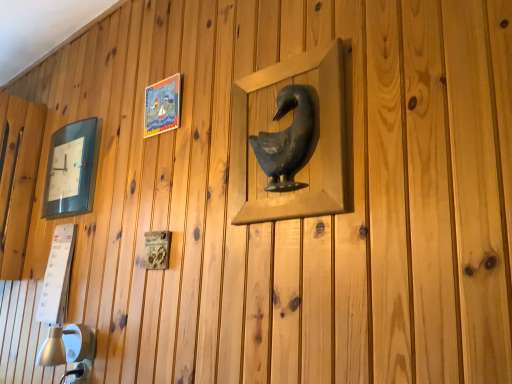
Find the location of a particular element. This screenshot has width=512, height=384. matte plastic picture frame at upper left, the 2th picture frame when ordered from back to front is located at coordinates (162, 106).

Describe the element at coordinates (286, 125) in the screenshot. This screenshot has height=384, width=512. I see `metallic gray bird at center, the first picture frame in the front-to-back sequence` at that location.

At what (x,y) coordinates should I click in order to perform the action: click on matte plastic picture frame at upper left, the second picture frame when ordered from front to back. Please return your answer as a coordinate pair (x, y). The image size is (512, 384). Looking at the image, I should click on (162, 106).

Considering the positions of points (295, 211) and (76, 165), is point (295, 211) farther from camera compared to point (76, 165)?

No, (295, 211) is in front of (76, 165).

Which object is more forward, metallic gray bird at center, the first picture frame when ordered from right to left, or matte black clock at left, the first picture frame from the back?

metallic gray bird at center, the first picture frame when ordered from right to left, is more forward.

Is metallic gray bird at center, the first picture frame when ordered from right to left, thinner than matte black clock at left, the 3th picture frame when ordered from right to left?

Indeed, metallic gray bird at center, the first picture frame when ordered from right to left, has a lesser width compared to matte black clock at left, the 3th picture frame when ordered from right to left.

Consider the image. Could you tell me if metallic gray bird at center, arranged as the 3th picture frame when viewed from the back, is facing matte black clock at left, the first picture frame from the back?

No.

Would you consider matte plastic picture frame at upper left, the second picture frame when ordered from front to back, to be distant from matte black clock at left, the 3th picture frame when ordered from right to left?

No, matte plastic picture frame at upper left, the second picture frame when ordered from front to back, is not far away from matte black clock at left, the 3th picture frame when ordered from right to left.

From the image's perspective, starting from the matte plastic picture frame at upper left, marked as the 2th picture frame in a right-to-left arrangement, which picture frame is the 2nd one below? Please provide its 2D coordinates.

[(72, 169)]

Is matte plastic picture frame at upper left, the second picture frame when ordered from front to back, located outside matte black clock at left, the 3th picture frame when ordered from right to left?

That's correct, matte plastic picture frame at upper left, the second picture frame when ordered from front to back, is outside of matte black clock at left, the 3th picture frame when ordered from right to left.

From the image's perspective, which one is positioned lower, matte plastic picture frame at upper left, the 2th picture frame when ordered from back to front, or matte black clock at left, placed as the third picture frame when sorted from front to back?

matte black clock at left, placed as the third picture frame when sorted from front to back, from the image's perspective.

Which object is further away from the camera taking this photo, matte plastic picture frame at upper left, the second picture frame when ordered from front to back, or metallic gray bird at center, arranged as the 3th picture frame when viewed from the back?

matte plastic picture frame at upper left, the second picture frame when ordered from front to back, is behind.

How far apart are matte plastic picture frame at upper left, marked as the 2th picture frame in a right-to-left arrangement, and metallic gray bird at center, the first picture frame when ordered from right to left?

matte plastic picture frame at upper left, marked as the 2th picture frame in a right-to-left arrangement, and metallic gray bird at center, the first picture frame when ordered from right to left, are 37.50 centimeters apart.

Considering the positions of points (181, 77) and (274, 216), is point (181, 77) farther from camera compared to point (274, 216)?

Yes, it is behind point (274, 216).

From a real-world perspective, which object stands above the other?

matte plastic picture frame at upper left, the 2th picture frame when ordered from left to right, from a real-world perspective.

Can you confirm if matte black clock at left, the 1th picture frame when ordered from left to right, is smaller than matte plastic picture frame at upper left, the second picture frame when ordered from front to back?

No, matte black clock at left, the 1th picture frame when ordered from left to right, is not smaller than matte plastic picture frame at upper left, the second picture frame when ordered from front to back.

Can matte plastic picture frame at upper left, marked as the 2th picture frame in a right-to-left arrangement, be found inside matte black clock at left, placed as the third picture frame when sorted from front to back?

No, matte plastic picture frame at upper left, marked as the 2th picture frame in a right-to-left arrangement, is not inside matte black clock at left, placed as the third picture frame when sorted from front to back.

Is matte black clock at left, the 3th picture frame when ordered from right to left, positioned with its back to matte plastic picture frame at upper left, marked as the 2th picture frame in a right-to-left arrangement?

No.

Identify the location of picture frame above the matte black clock at left, placed as the third picture frame when sorted from front to back (from a real-world perspective). (162, 106).

From a real-world perspective, is matte black clock at left, the first picture frame from the back, physically located above or below metallic gray bird at center, which is the third picture frame from left to right?

From a real-world perspective, matte black clock at left, the first picture frame from the back, is physically above metallic gray bird at center, which is the third picture frame from left to right.

Is metallic gray bird at center, the first picture frame in the front-to-back sequence, surrounded by matte black clock at left, placed as the third picture frame when sorted from front to back?

No, metallic gray bird at center, the first picture frame in the front-to-back sequence, is located outside of matte black clock at left, placed as the third picture frame when sorted from front to back.

Looking at their sizes, would you say matte black clock at left, the 1th picture frame when ordered from left to right, is wider or thinner than metallic gray bird at center, which is the third picture frame from left to right?

Clearly, matte black clock at left, the 1th picture frame when ordered from left to right, has more width compared to metallic gray bird at center, which is the third picture frame from left to right.

Is metallic gray bird at center, the first picture frame when ordered from right to left, at the back of matte black clock at left, the first picture frame from the back?

No, matte black clock at left, the first picture frame from the back,'s orientation is not away from metallic gray bird at center, the first picture frame when ordered from right to left.

From a real-world perspective, is metallic gray bird at center, the first picture frame in the front-to-back sequence, over matte plastic picture frame at upper left, the 2th picture frame when ordered from back to front?

No, from a real-world perspective, metallic gray bird at center, the first picture frame in the front-to-back sequence, is not on top of matte plastic picture frame at upper left, the 2th picture frame when ordered from back to front.

Is metallic gray bird at center, which is the third picture frame from left to right, oriented away from matte plastic picture frame at upper left, the 2th picture frame when ordered from left to right?

No, metallic gray bird at center, which is the third picture frame from left to right,'s orientation is not away from matte plastic picture frame at upper left, the 2th picture frame when ordered from left to right.

Identify the location of the 1st picture frame counting from the left side of the metallic gray bird at center, the first picture frame in the front-to-back sequence. This screenshot has width=512, height=384. (162, 106).

From the image's perspective, count 1st picture frames upward from the matte black clock at left, the 1th picture frame when ordered from left to right, and point to it. Please provide its 2D coordinates.

[(286, 125)]

Locate an element on the screen. This screenshot has height=384, width=512. the 1st picture frame in front of the matte black clock at left, the 3th picture frame when ordered from right to left is located at coordinates (162, 106).

When comparing their distances from matte plastic picture frame at upper left, the 2th picture frame when ordered from back to front, does metallic gray bird at center, which is the third picture frame from left to right, or matte black clock at left, placed as the third picture frame when sorted from front to back, seem further?

metallic gray bird at center, which is the third picture frame from left to right, lies further to matte plastic picture frame at upper left, the 2th picture frame when ordered from back to front, than the other object.

Based on the photo, which object lies nearer to the anchor point matte plastic picture frame at upper left, the second picture frame when ordered from front to back, matte black clock at left, the 3th picture frame when ordered from right to left, or metallic gray bird at center, the first picture frame when ordered from right to left?

Based on the image, matte black clock at left, the 3th picture frame when ordered from right to left, appears to be nearer to matte plastic picture frame at upper left, the second picture frame when ordered from front to back.

When comparing their distances from matte black clock at left, the first picture frame from the back, does matte plastic picture frame at upper left, the 2th picture frame when ordered from left to right, or metallic gray bird at center, arranged as the 3th picture frame when viewed from the back, seem further?

metallic gray bird at center, arranged as the 3th picture frame when viewed from the back.

From the image, which object appears to be farther from metallic gray bird at center, the first picture frame when ordered from right to left, matte plastic picture frame at upper left, the second picture frame when ordered from front to back, or matte black clock at left, the 3th picture frame when ordered from right to left?

The object further to metallic gray bird at center, the first picture frame when ordered from right to left, is matte black clock at left, the 3th picture frame when ordered from right to left.

Based on their spatial positions, is matte black clock at left, the 1th picture frame when ordered from left to right, or matte plastic picture frame at upper left, the 2th picture frame when ordered from back to front, closer to metallic gray bird at center, the first picture frame when ordered from right to left?

matte plastic picture frame at upper left, the 2th picture frame when ordered from back to front, lies closer to metallic gray bird at center, the first picture frame when ordered from right to left, than the other object.

Based on their spatial positions, is metallic gray bird at center, arranged as the 3th picture frame when viewed from the back, or matte plastic picture frame at upper left, the second picture frame when ordered from front to back, closer to matte black clock at left, the 3th picture frame when ordered from right to left?

Based on the image, matte plastic picture frame at upper left, the second picture frame when ordered from front to back, appears to be nearer to matte black clock at left, the 3th picture frame when ordered from right to left.

Find the location of `picture frame situated between matte black clock at left, the 1th picture frame when ordered from left to right, and metallic gray bird at center, arranged as the 3th picture frame when viewed from the back, from left to right`. picture frame situated between matte black clock at left, the 1th picture frame when ordered from left to right, and metallic gray bird at center, arranged as the 3th picture frame when viewed from the back, from left to right is located at coordinates (162, 106).